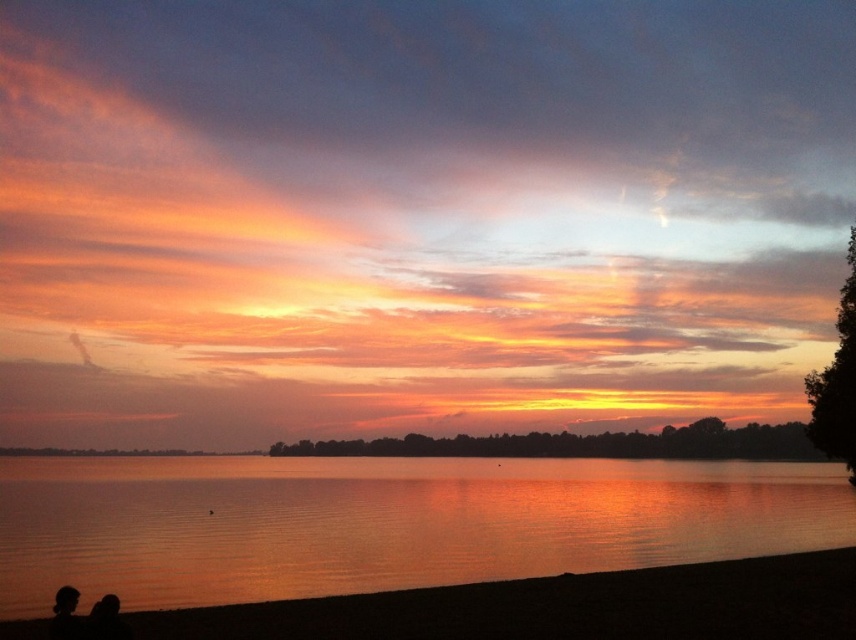
Question: Does shiny reflective water at center have a smaller size compared to silhouette couple at lower left?

Choices:
 (A) yes
 (B) no

Answer: (B)

Question: Does shiny reflective water at center appear under silhouette couple at lower left?

Choices:
 (A) no
 (B) yes

Answer: (B)

Question: Considering the real-world distances, which object is farthest from the shiny reflective water at center?

Choices:
 (A) silhouette skin at lower left
 (B) silhouette couple at lower left

Answer: (A)

Question: Estimate the real-world distances between objects in this image. Which object is closer to the silhouette skin at lower left?

Choices:
 (A) shiny reflective water at center
 (B) silhouette couple at lower left

Answer: (B)

Question: Does shiny reflective water at center appear on the right side of silhouette skin at lower left?

Choices:
 (A) no
 (B) yes

Answer: (A)

Question: Which object is the closest to the shiny reflective water at center?

Choices:
 (A) silhouette couple at lower left
 (B) silhouette skin at lower left

Answer: (A)